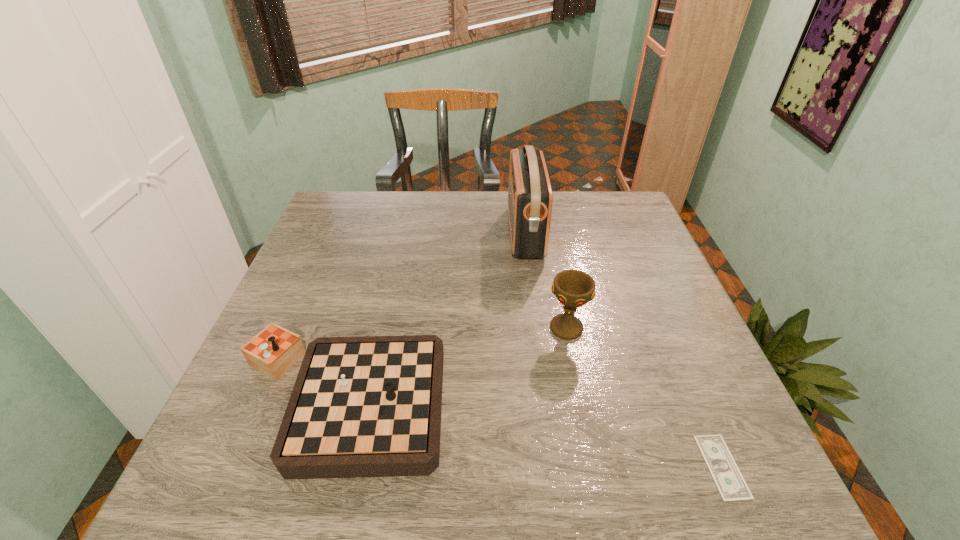
In order to click on the farthest object in this screenshot , I will do `click(530, 198)`.

Identify the location of the tallest object. Image resolution: width=960 pixels, height=540 pixels. pyautogui.click(x=530, y=198).

Image resolution: width=960 pixels, height=540 pixels. Identify the location of the second tallest object. (573, 288).

Identify the location of the third tallest object. (370, 406).

You are a GUI agent. You are given a task and a screenshot of the screen. Output one action in this format:
    pyautogui.click(x=<x>, y=<y>)
    Task: Click on the chessboard
    This screenshot has width=960, height=540.
    Given the screenshot: What is the action you would take?
    pyautogui.click(x=370, y=406)

What are the coordinates of `the rightmost object` in the screenshot? It's located at (732, 487).

Where is `money`? This screenshot has height=540, width=960. money is located at coordinates (732, 487).

The image size is (960, 540). Identify the location of vacant space located 0.400m on the front-facing side of the radio receiver. (370, 233).

This screenshot has height=540, width=960. Identify the location of vacant point located on the front-facing side of the radio receiver. (419, 233).

Locate an element on the screen. This screenshot has height=540, width=960. blank space located on the front-facing side of the radio receiver is located at coordinates (394, 233).